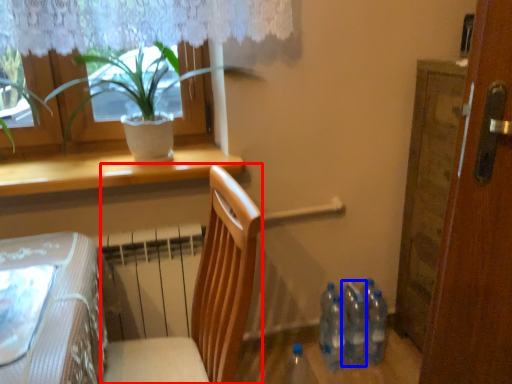
Question: Which of the following is the closest to the observer, chair (highlighted by a red box) or bottle (highlighted by a blue box)?

Choices:
 (A) chair
 (B) bottle

Answer: (A)